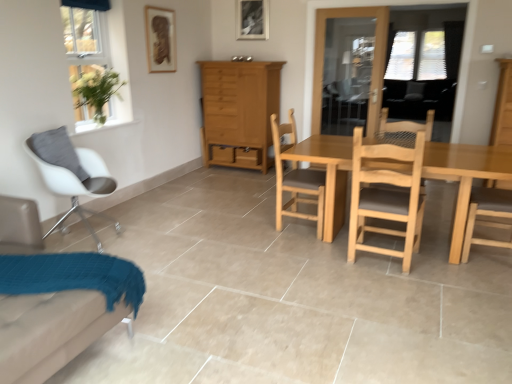
Question: Is light wood dresser at right thinner than white matte chair at left, which appears as the first chair when viewed from the left?

Choices:
 (A) no
 (B) yes

Answer: (B)

Question: Is light wood dresser at right far away from white matte chair at left, which appears as the first chair when viewed from the left?

Choices:
 (A) no
 (B) yes

Answer: (B)

Question: Can you confirm if light wood dresser at right is positioned to the left of white matte chair at left, which is the fourth chair in right-to-left order?

Choices:
 (A) no
 (B) yes

Answer: (A)

Question: From the image's perspective, is light wood dresser at right over white matte chair at left, which appears as the first chair when viewed from the left?

Choices:
 (A) yes
 (B) no

Answer: (A)

Question: From a real-world perspective, is light wood dresser at right physically below white matte chair at left, which appears as the first chair when viewed from the left?

Choices:
 (A) yes
 (B) no

Answer: (B)

Question: From a real-world perspective, is light brown wooden table at center right above or below natural wood chair at center, positioned as the first chair in right-to-left order?

Choices:
 (A) below
 (B) above

Answer: (A)

Question: Is light brown wooden table at center right taller or shorter than natural wood chair at center, marked as the fourth chair in a left-to-right arrangement?

Choices:
 (A) short
 (B) tall

Answer: (A)

Question: From the image's perspective, is light brown wooden table at center right positioned above or below natural wood chair at center, marked as the fourth chair in a left-to-right arrangement?

Choices:
 (A) below
 (B) above

Answer: (A)

Question: Is light brown wooden table at center right spatially inside natural wood chair at center, marked as the fourth chair in a left-to-right arrangement, or outside of it?

Choices:
 (A) inside
 (B) outside

Answer: (B)

Question: Is white fabric chair at lower left, the 3th chair when ordered from right to left, taller or shorter than matte brown picture frame at upper center, marked as the 1th picture frame in a left-to-right arrangement?

Choices:
 (A) short
 (B) tall

Answer: (B)

Question: Is white fabric chair at lower left, arranged as the second chair when viewed from the left, inside the boundaries of matte brown picture frame at upper center, marked as the 1th picture frame in a left-to-right arrangement, or outside?

Choices:
 (A) outside
 (B) inside

Answer: (A)

Question: Is point (31, 365) positioned closer to the camera than point (161, 52)?

Choices:
 (A) farther
 (B) closer

Answer: (B)

Question: From a real-world perspective, is white fabric chair at lower left, arranged as the second chair when viewed from the left, physically located above or below matte brown picture frame at upper center, marked as the 1th picture frame in a left-to-right arrangement?

Choices:
 (A) above
 (B) below

Answer: (B)

Question: Would you say light brown wood cabinet at center is inside or outside clear glass window at upper left?

Choices:
 (A) outside
 (B) inside

Answer: (A)

Question: In terms of height, does light brown wood cabinet at center look taller or shorter compared to clear glass window at upper left?

Choices:
 (A) short
 (B) tall

Answer: (B)